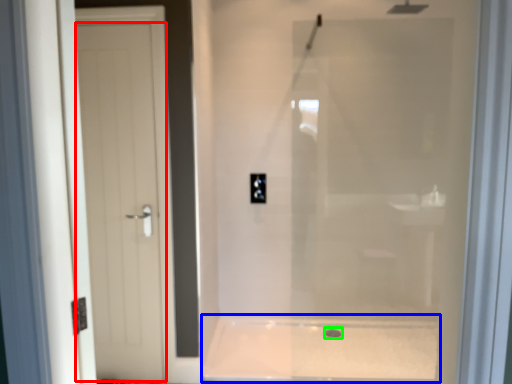
Question: Estimate the real-world distances between objects in this image. Which object is closer to door (highlighted by a red box), bath (highlighted by a blue box) or drain (highlighted by a green box)?

Choices:
 (A) bath
 (B) drain

Answer: (A)